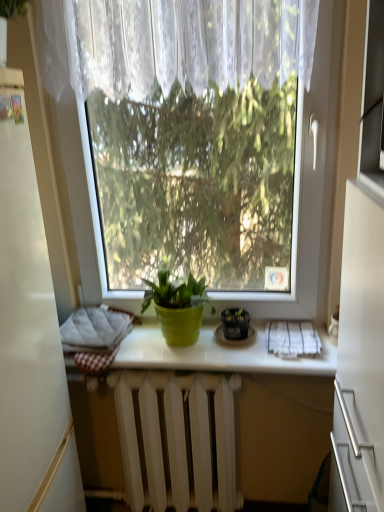
Measure the distance between matte black pot at center, which is the first houseplant from right to left, and camera.

matte black pot at center, which is the first houseplant from right to left, is 1.34 meters away from camera.

What do you see at coordinates (235, 323) in the screenshot? I see `matte black pot at center, acting as the 2th houseplant starting from the left` at bounding box center [235, 323].

I want to click on green matte pot at center, which is the 1th houseplant from left to right, so click(177, 307).

I want to click on white textured cloth at lower right, so click(x=293, y=338).

Image resolution: width=384 pixels, height=512 pixels. Describe the element at coordinates (293, 338) in the screenshot. I see `white textured cloth at lower right` at that location.

This screenshot has width=384, height=512. Describe the element at coordinates (219, 354) in the screenshot. I see `green matte pot at center` at that location.

Where is `green matte pot at center`? The height and width of the screenshot is (512, 384). green matte pot at center is located at coordinates (219, 354).

You are a GUI agent. You are given a task and a screenshot of the screen. Output one action in this format:
    pyautogui.click(x=<x>, y=<y>)
    Task: Click on the white painted metal radiator at center
    The image size is (384, 512).
    Given the screenshot: What is the action you would take?
    pyautogui.click(x=177, y=438)

Who is smaller, white painted metal radiator at center or white textured cloth at lower right?

Smaller between the two is white textured cloth at lower right.

Which is more to the left, white painted metal radiator at center or white textured cloth at lower right?

white painted metal radiator at center is more to the left.

From a real-world perspective, does white painted metal radiator at center stand above white textured cloth at lower right?

Actually, white painted metal radiator at center is physically below white textured cloth at lower right in the real world.

In the scene shown: Is matte black pot at center, acting as the 2th houseplant starting from the left, not close to green matte pot at center, which is the 1th houseplant from left to right?

No, matte black pot at center, acting as the 2th houseplant starting from the left, is not far from green matte pot at center, which is the 1th houseplant from left to right.

How different are the orientations of matte black pot at center, acting as the 2th houseplant starting from the left, and green matte pot at center, which is counted as the second houseplant, starting from the right, in degrees?

The angle between the facing direction of matte black pot at center, acting as the 2th houseplant starting from the left, and the facing direction of green matte pot at center, which is counted as the second houseplant, starting from the right, is 0.00182 degrees.

From a real-world perspective, is matte black pot at center, acting as the 2th houseplant starting from the left, under green matte pot at center, which is counted as the second houseplant, starting from the right?

Yes.

In the scene shown: Which is behind, matte black pot at center, acting as the 2th houseplant starting from the left, or green matte pot at center, which is the 1th houseplant from left to right?

matte black pot at center, acting as the 2th houseplant starting from the left, is further from the camera.

Choose the correct answer: Is white lace curtain at upper center inside green matte pot at center or outside it?

white lace curtain at upper center is not inside green matte pot at center, it's outside.

Locate an element on the screen. The height and width of the screenshot is (512, 384). curtain above the green matte pot at center (from a real-world perspective) is located at coordinates (187, 44).

Considering the relative positions of white lace curtain at upper center and green matte pot at center in the image provided, is white lace curtain at upper center behind green matte pot at center?

No.

Looking at the image, does white lace curtain at upper center seem bigger or smaller compared to green matte pot at center?

Clearly, white lace curtain at upper center is larger in size than green matte pot at center.

Which is in front, point (121, 390) or point (194, 354)?

The point (194, 354) is closer.

From a real-world perspective, who is located higher, white painted metal radiator at center or green matte pot at center?

From a 3D spatial view, green matte pot at center is above.

Consider the image. Is white painted metal radiator at center positioned behind green matte pot at center?

Yes, white painted metal radiator at center is further from the camera.

Locate an element on the screen. radiator that appears below the green matte pot at center (from a real-world perspective) is located at coordinates (177, 438).

I want to click on houseplant that is the 2nd one when counting downward from the white lace curtain at upper center (from the image's perspective), so click(x=235, y=323).

Is matte black pot at center, acting as the 2th houseplant starting from the left, at the left side of white lace curtain at upper center?

Incorrect, matte black pot at center, acting as the 2th houseplant starting from the left, is not on the left side of white lace curtain at upper center.

Looking at this image, how different are the orientations of matte black pot at center, acting as the 2th houseplant starting from the left, and white lace curtain at upper center in degrees?

1.22 degrees.

Is matte black pot at center, acting as the 2th houseplant starting from the left, placed right next to white lace curtain at upper center?

No, matte black pot at center, acting as the 2th houseplant starting from the left, is not in contact with white lace curtain at upper center.

Which of these two, white lace curtain at upper center or transparent glass window at center, is thinner?

With smaller width is transparent glass window at center.

Are white lace curtain at upper center and transparent glass window at center making contact?

No, white lace curtain at upper center is not making contact with transparent glass window at center.

Does white lace curtain at upper center lie in front of transparent glass window at center?

Yes, it is in front of transparent glass window at center.

This screenshot has height=512, width=384. I want to click on window behind the white lace curtain at upper center, so click(310, 187).

From the image's perspective, which object appears higher, transparent glass window at center or matte black pot at center, acting as the 2th houseplant starting from the left?

transparent glass window at center.

Which is behind, transparent glass window at center or matte black pot at center, which is the first houseplant from right to left?

matte black pot at center, which is the first houseplant from right to left, is more distant.

Based on the photo, considering the relative sizes of transparent glass window at center and matte black pot at center, acting as the 2th houseplant starting from the left, in the image provided, is transparent glass window at center taller than matte black pot at center, acting as the 2th houseplant starting from the left,?

Correct, transparent glass window at center is much taller as matte black pot at center, acting as the 2th houseplant starting from the left.

Is transparent glass window at center facing away from matte black pot at center, which is the first houseplant from right to left?

No, transparent glass window at center's orientation is not away from matte black pot at center, which is the first houseplant from right to left.

In order to click on cloth that is above the white painted metal radiator at center (from the image's perspective) in this screenshot , I will do `click(293, 338)`.

Find the location of a particular element. The height and width of the screenshot is (512, 384). houseplant on the left of matte black pot at center, acting as the 2th houseplant starting from the left is located at coordinates (177, 307).

Based on their spatial positions, is white painted metal radiator at center or green matte pot at center, which is the 1th houseplant from left to right, further from matte black pot at center, acting as the 2th houseplant starting from the left?

Among the two, white painted metal radiator at center is located further to matte black pot at center, acting as the 2th houseplant starting from the left.

Looking at the image, which one is located further to transparent glass window at center, white painted metal radiator at center or white textured cloth at lower right?

Based on the image, white painted metal radiator at center appears to be further to transparent glass window at center.

Based on their spatial positions, is matte black pot at center, which is the first houseplant from right to left, or green matte pot at center, which is counted as the second houseplant, starting from the right, closer to transparent glass window at center?

green matte pot at center, which is counted as the second houseplant, starting from the right, lies closer to transparent glass window at center than the other object.

Consider the image. Considering their positions, is transparent glass window at center positioned further to white painted metal radiator at center than matte black pot at center, acting as the 2th houseplant starting from the left?

transparent glass window at center.

When comparing their distances from matte black pot at center, acting as the 2th houseplant starting from the left, does white painted metal radiator at center or white lace curtain at upper center seem further?

Based on the image, white lace curtain at upper center appears to be further to matte black pot at center, acting as the 2th houseplant starting from the left.

From the image, which object appears to be farther from transparent glass window at center, white painted metal radiator at center or matte black pot at center, which is the first houseplant from right to left?

white painted metal radiator at center is further to transparent glass window at center.

Considering their positions, is green matte pot at center positioned closer to transparent glass window at center than white textured cloth at lower right?

The object closer to transparent glass window at center is white textured cloth at lower right.

Which object lies further to the anchor point white textured cloth at lower right, white lace curtain at upper center or green matte pot at center?

white lace curtain at upper center lies further to white textured cloth at lower right than the other object.

You are a GUI agent. You are given a task and a screenshot of the screen. Output one action in this format:
    pyautogui.click(x=<x>, y=<y>)
    Task: Click on the houseplant between green matte pot at center, which is the 1th houseplant from left to right, and white textured cloth at lower right
    
    Given the screenshot: What is the action you would take?
    pyautogui.click(x=235, y=323)

Where is `counter top that lies between matte black pot at center, acting as the 2th houseplant starting from the left, and white painted metal radiator at center from top to bottom`? The height and width of the screenshot is (512, 384). counter top that lies between matte black pot at center, acting as the 2th houseplant starting from the left, and white painted metal radiator at center from top to bottom is located at coordinates (219, 354).

In order to click on counter top between green matte pot at center, which is the 1th houseplant from left to right, and white painted metal radiator at center, in the vertical direction in this screenshot , I will do `click(219, 354)`.

I want to click on counter top that lies between white lace curtain at upper center and white painted metal radiator at center from top to bottom, so click(219, 354).